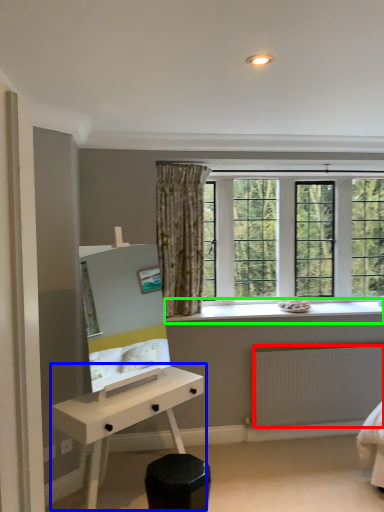
Question: Which is farther away from radiator (highlighted by a red box)? desk (highlighted by a blue box) or window sill (highlighted by a green box)?

Choices:
 (A) desk
 (B) window sill

Answer: (A)